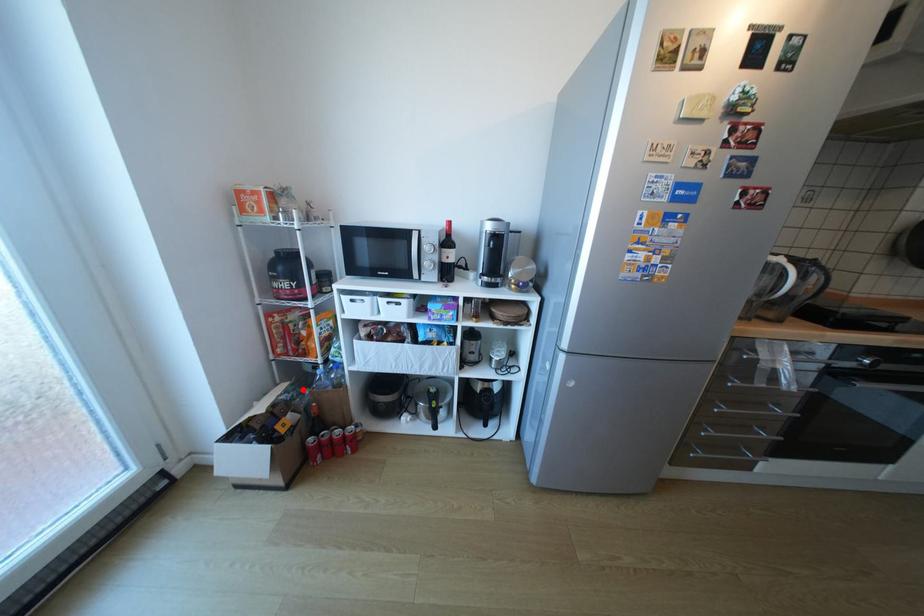
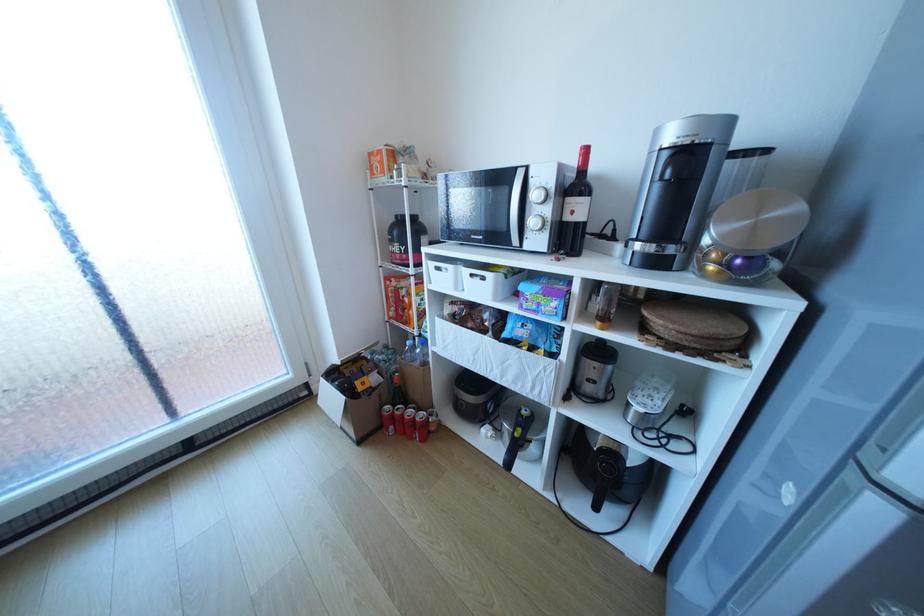
The point at the highlighted location is marked in the first image. Where is the corresponding point in the second image?

(402, 354)